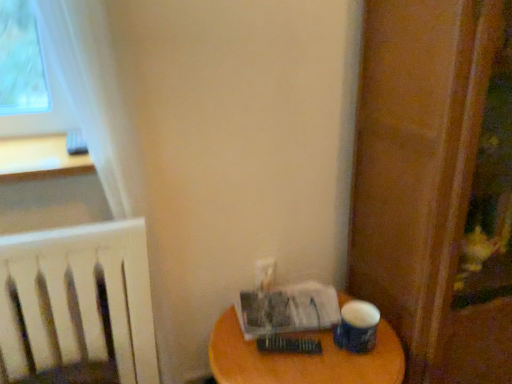
Question: Is white paper at lower right, positioned as the first paperback book in back-to-front order, to the left of hardcover book at center, marked as the first paperback book in a front-to-back arrangement, from the viewer's perspective?

Choices:
 (A) yes
 (B) no

Answer: (A)

Question: Is white paper at lower right, arranged as the 2th paperback book when viewed from the front, thinner than hardcover book at center, marked as the first paperback book in a front-to-back arrangement?

Choices:
 (A) no
 (B) yes

Answer: (A)

Question: Is white paper at lower right, positioned as the first paperback book in back-to-front order, beside hardcover book at center, the 2th paperback book in the back-to-front sequence?

Choices:
 (A) yes
 (B) no

Answer: (B)

Question: Is white paper at lower right, positioned as the first paperback book in back-to-front order, outside of hardcover book at center, marked as the first paperback book in a front-to-back arrangement?

Choices:
 (A) yes
 (B) no

Answer: (A)

Question: From the image's perspective, is white paper at lower right, arranged as the 2th paperback book when viewed from the front, located above hardcover book at center, marked as the first paperback book in a front-to-back arrangement?

Choices:
 (A) no
 (B) yes

Answer: (B)

Question: Looking at their shapes, would you say hardcover book at center, marked as the first paperback book in a front-to-back arrangement, is wider or thinner than white paper at lower right, arranged as the 2th paperback book when viewed from the front?

Choices:
 (A) wide
 (B) thin

Answer: (B)

Question: From a real-world perspective, is hardcover book at center, the 2th paperback book in the back-to-front sequence, above or below white paper at lower right, positioned as the first paperback book in back-to-front order?

Choices:
 (A) above
 (B) below

Answer: (B)

Question: Is hardcover book at center, marked as the first paperback book in a front-to-back arrangement, bigger or smaller than white paper at lower right, arranged as the 2th paperback book when viewed from the front?

Choices:
 (A) small
 (B) big

Answer: (A)

Question: Does point (x=282, y=342) appear closer or farther from the camera than point (x=332, y=312)?

Choices:
 (A) closer
 (B) farther

Answer: (A)

Question: From the image's perspective, is wooden screen door at right above or below blue matte paper cup at lower right?

Choices:
 (A) above
 (B) below

Answer: (A)

Question: Considering the relative positions of wooden screen door at right and blue matte paper cup at lower right in the image provided, is wooden screen door at right to the left or to the right of blue matte paper cup at lower right?

Choices:
 (A) left
 (B) right

Answer: (B)

Question: In terms of height, does wooden screen door at right look taller or shorter compared to blue matte paper cup at lower right?

Choices:
 (A) short
 (B) tall

Answer: (B)

Question: From a real-world perspective, is wooden screen door at right above or below blue matte paper cup at lower right?

Choices:
 (A) above
 (B) below

Answer: (A)

Question: Do you think blue matte paper cup at lower right is within wooden screen door at right, or outside of it?

Choices:
 (A) outside
 (B) inside

Answer: (A)

Question: Is point (373, 314) positioned closer to the camera than point (479, 162)?

Choices:
 (A) farther
 (B) closer

Answer: (A)